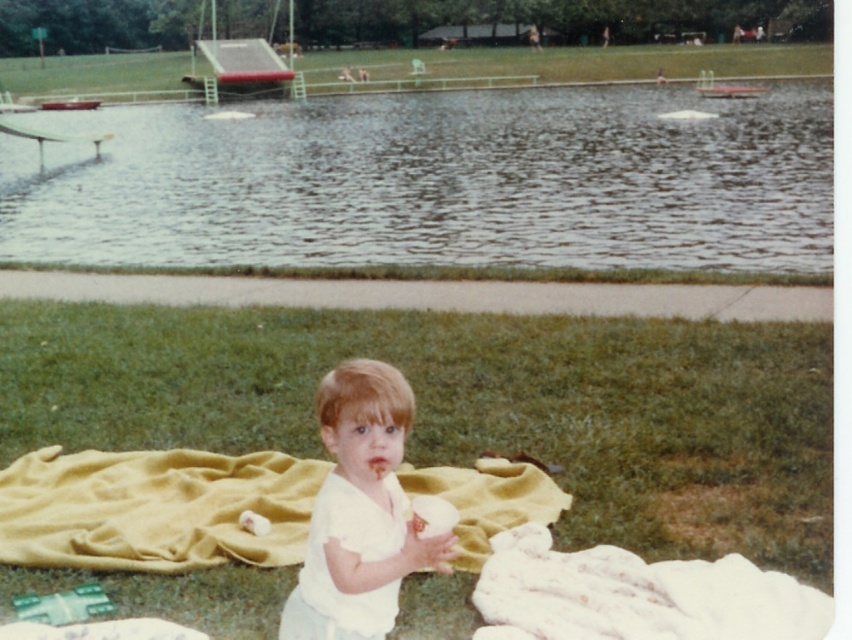
From the picture: You are a drone operator trying to capture a photo of the child standing on grass. The drone is currently at point (436, 182) which is on glossy water at upper center. To get a clear shot of the child, should you move the drone towards the left or right direction?

The point (436, 182) is on glossy water at upper center. To capture the child on the grass, you should move the drone towards the left direction since the child is positioned to the left of the glossy water at upper center.

You are standing at the point marked as point (471,406). What is the color of the ground beneath your feet?

The ground beneath your feet at point (471,406) is green grass at center.

You are a parent trying to decide where to place a new picnic basket in the park scene. The basket is 1 meter in length. The green grass at center and the white matte toddler at center are already present. Which object can the picnic basket fit next to without overlapping?

The picnic basket, which is 1 meter in length, can fit next to the white matte toddler at center since the toddler is larger in size compared to the green grass at center, providing enough space.